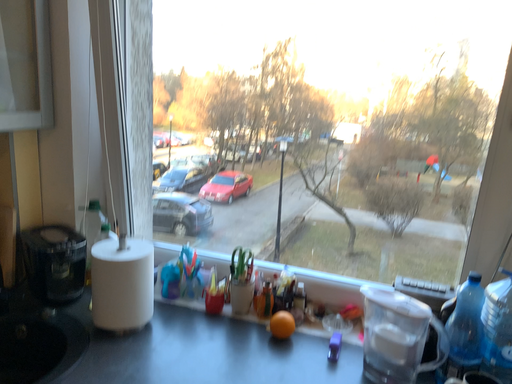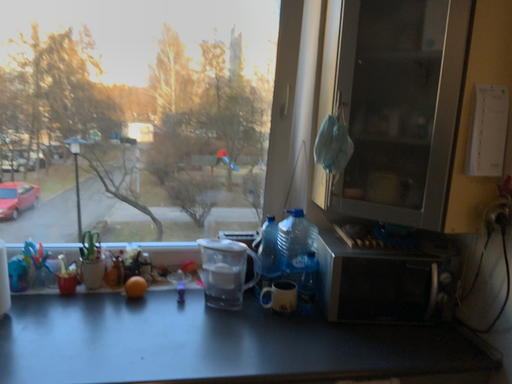
Question: How did the camera likely rotate when shooting the video?

Choices:
 (A) rotated right
 (B) rotated left

Answer: (A)